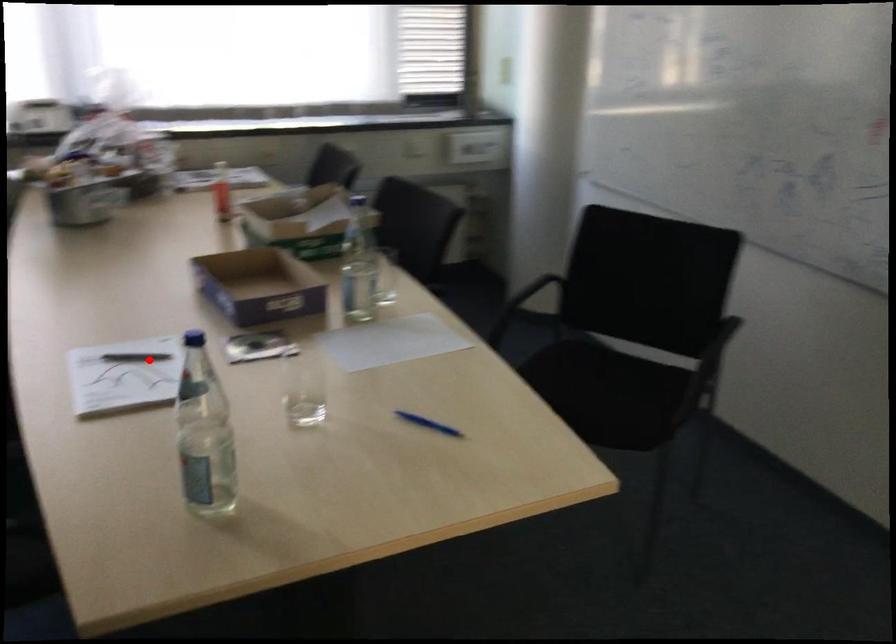
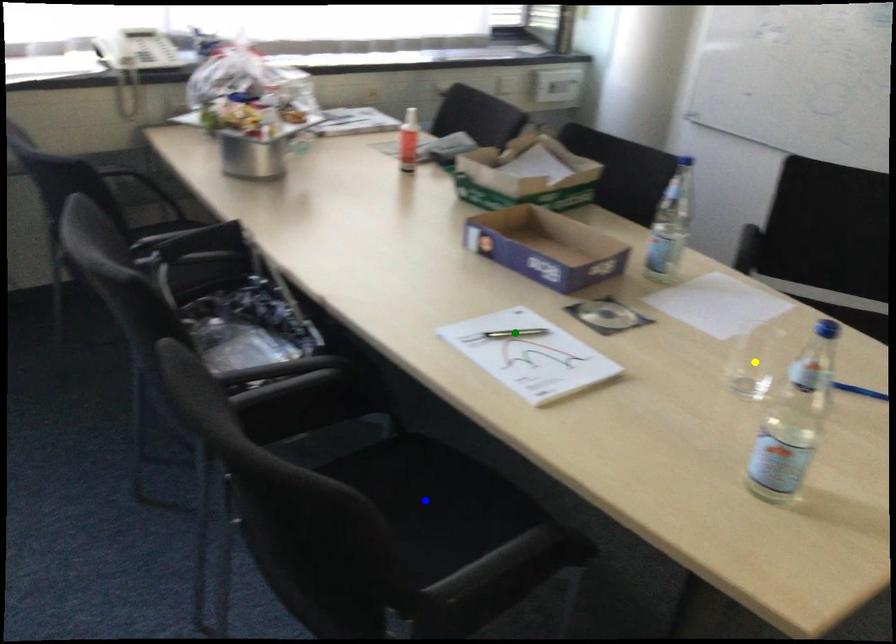
Question: I am providing you with two images of the same scene from different viewpoints. A red point is marked on the first image. You are given multiple points on the second image. Can you choose the point in image 2 that corresponds to the point in image 1?

Choices:
 (A) yellow point
 (B) green point
 (C) blue point

Answer: (B)